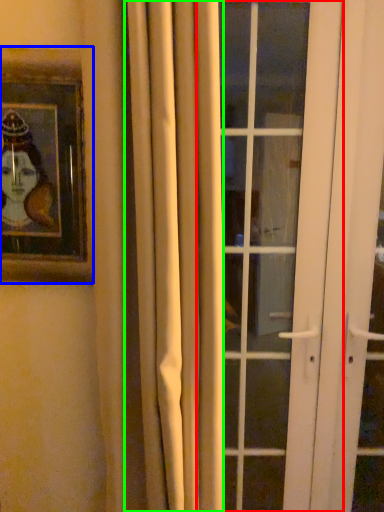
Question: Estimate the real-world distances between objects in this image. Which object is farther from door (highlighted by a red box), picture frame (highlighted by a blue box) or curtain (highlighted by a green box)?

Choices:
 (A) picture frame
 (B) curtain

Answer: (A)